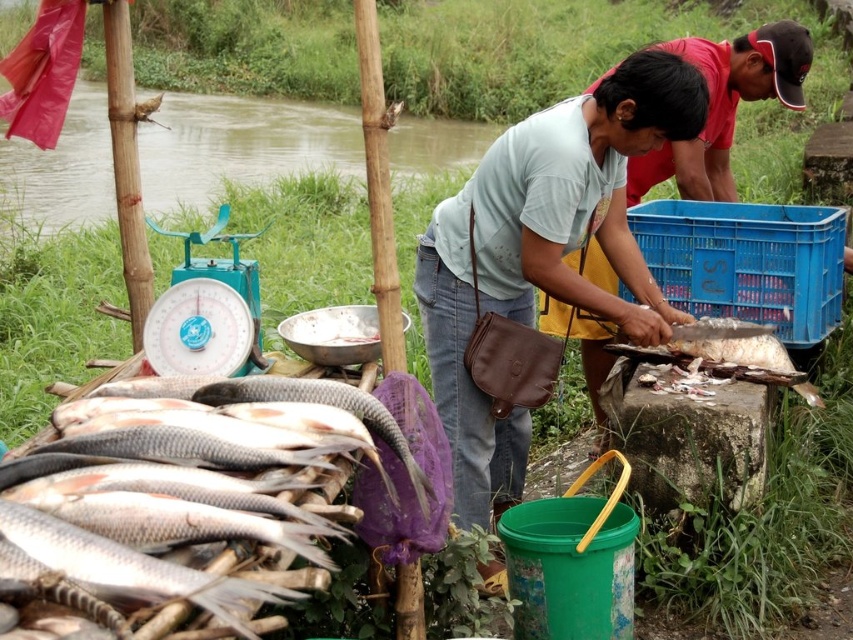
You are standing 2 meters away from the point at coordinates point (120, 557). Can you reach the point without moving closer than 1.47 meters?

The distance of point (120, 557) from viewer is 1.47 meters, so you are already at the required distance. You can reach the point without moving closer than 1.47 meters.